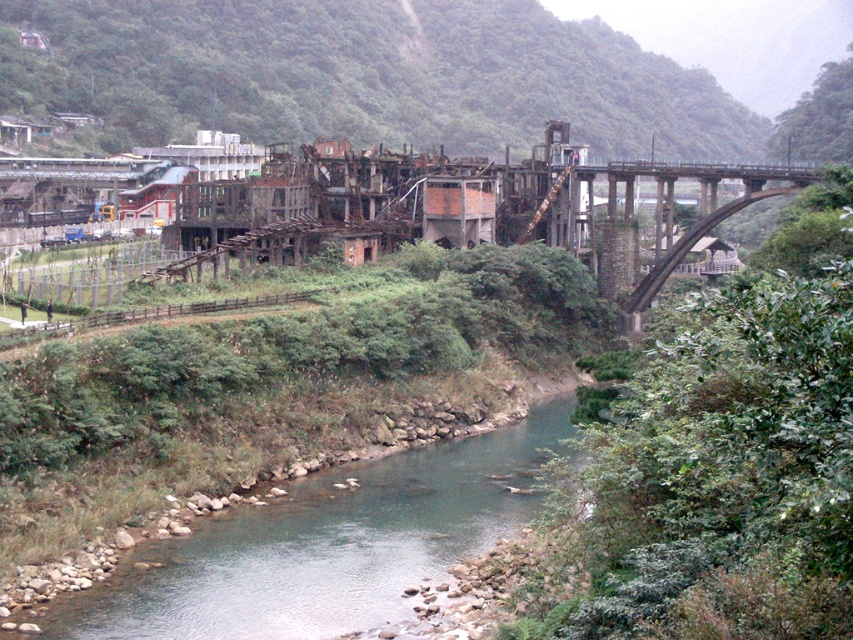
Is clear water at center below concrete arch bridge at right?

Correct, clear water at center is located below concrete arch bridge at right.

Who is more forward, (354, 544) or (699, 202)?

Point (354, 544) is more forward.

You are a GUI agent. You are given a task and a screenshot of the screen. Output one action in this format:
    pyautogui.click(x=<x>, y=<y>)
    Task: Click on the clear water at center
    Image resolution: width=853 pixels, height=640 pixels.
    Given the screenshot: What is the action you would take?
    pyautogui.click(x=329, y=544)

Where is `clear water at center`? This screenshot has height=640, width=853. clear water at center is located at coordinates (329, 544).